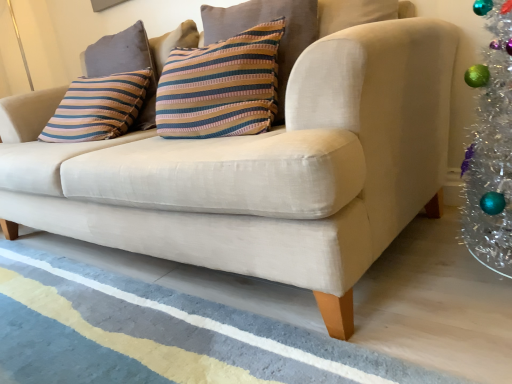
Question: Choose the correct answer: Is blue textured rug at lower center inside striped fabric pillow at upper left, which is the 1th pillow in left-to-right order, or outside it?

Choices:
 (A) outside
 (B) inside

Answer: (A)

Question: From a real-world perspective, is blue textured rug at lower center positioned above or below striped fabric pillow at upper left, the second pillow positioned from the right?

Choices:
 (A) above
 (B) below

Answer: (B)

Question: Based on their relative distances, which object is farther from the striped fabric pillow at center, which is the second pillow in back-to-front order?

Choices:
 (A) blue textured rug at lower center
 (B) striped fabric pillow at upper left, the 1th pillow positioned from the back

Answer: (A)

Question: Which object is positioned closest to the striped fabric pillow at upper left, which appears as the 2th pillow when viewed from the front?

Choices:
 (A) blue textured rug at lower center
 (B) striped fabric pillow at center, which is the second pillow in back-to-front order

Answer: (B)